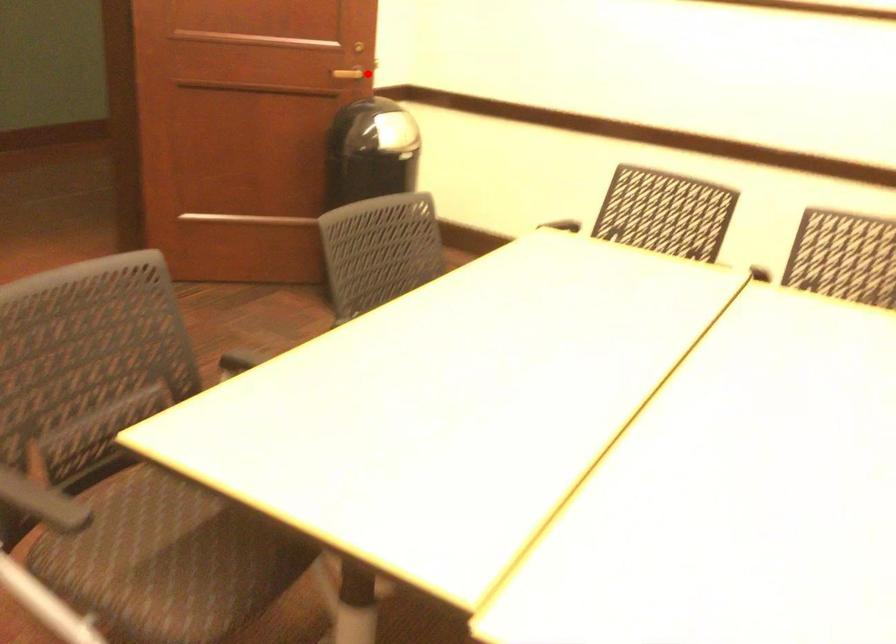
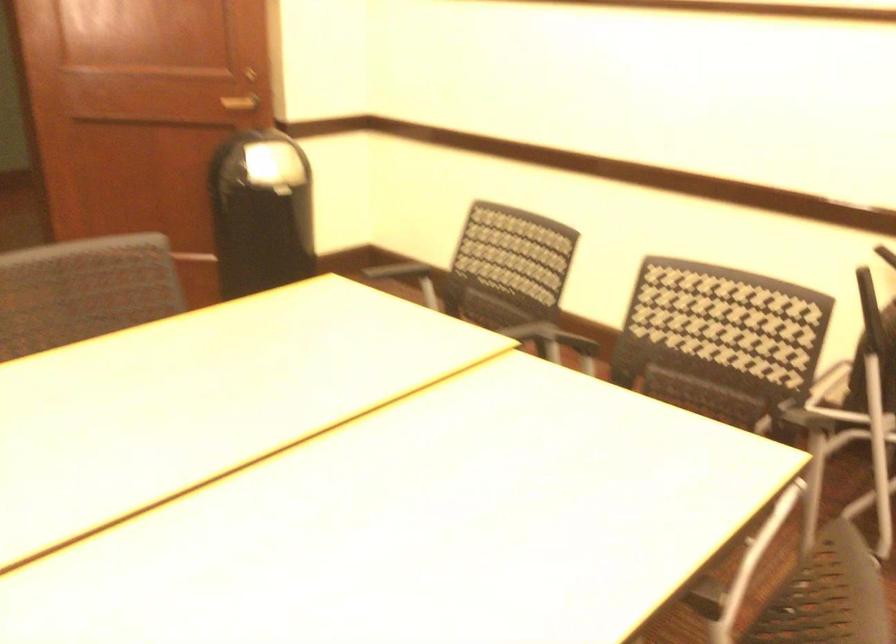
Where in the second image is the point corresponding to the highlighted location from the first image?

(240, 102)